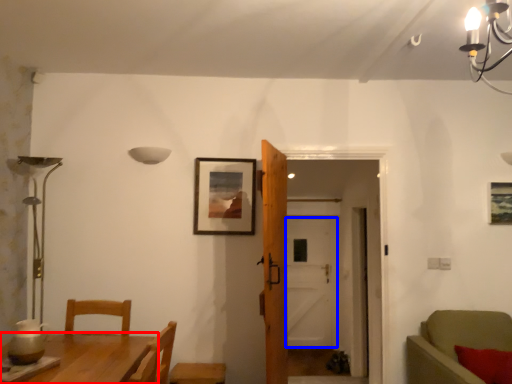
Question: Among these objects, which one is nearest to the camera, table (highlighted by a red box) or door (highlighted by a blue box)?

Choices:
 (A) table
 (B) door

Answer: (A)